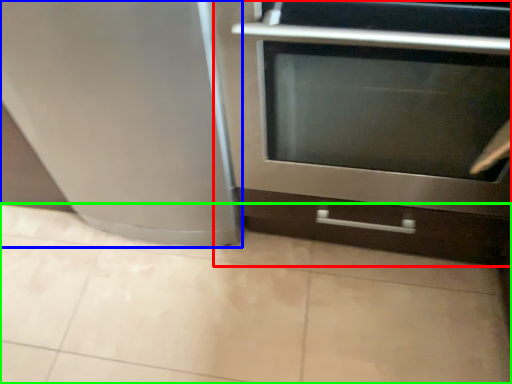
Question: Which object is the closest to the oven (highlighted by a red box)? Choose among these: appliance (highlighted by a blue box) or ceramic tile (highlighted by a green box).

Choices:
 (A) appliance
 (B) ceramic tile

Answer: (A)